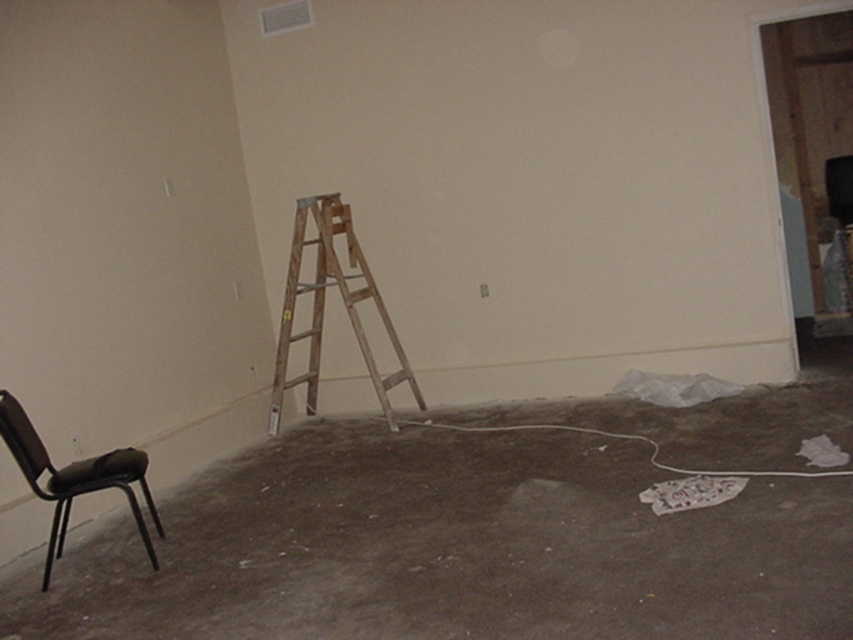
Question: Which of the following is the farthest from the observer?

Choices:
 (A) wooden ladder at center
 (B) brown leather chair at lower left

Answer: (A)

Question: Does wooden ladder at center have a lesser width compared to brown leather chair at lower left?

Choices:
 (A) yes
 (B) no

Answer: (B)

Question: From the image, what is the correct spatial relationship of wooden ladder at center in relation to brown leather chair at lower left?

Choices:
 (A) above
 (B) below

Answer: (A)

Question: Is wooden ladder at center smaller than brown leather chair at lower left?

Choices:
 (A) no
 (B) yes

Answer: (A)

Question: Which point is closer to the camera?

Choices:
 (A) brown leather chair at lower left
 (B) wooden ladder at center

Answer: (A)